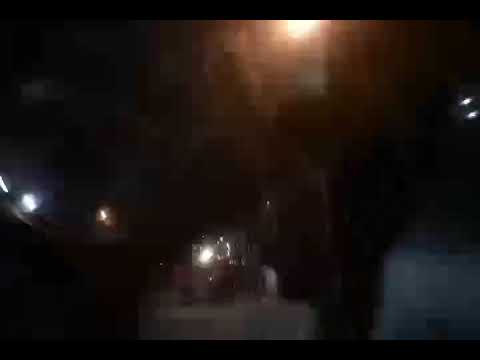
The image size is (480, 360). Find the location of `light orbs`. light orbs is located at coordinates (29, 204), (104, 217), (203, 258).